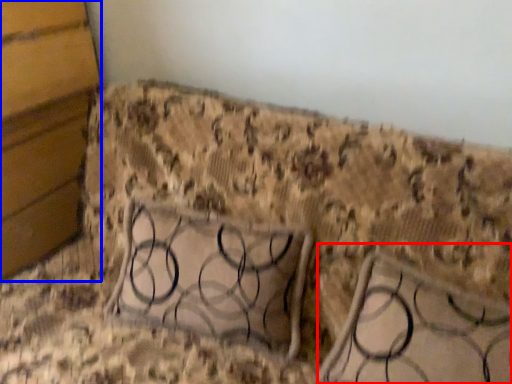
Question: Which object appears farthest to the camera in this image, furniture (highlighted by a red box) or panel (highlighted by a blue box)?

Choices:
 (A) furniture
 (B) panel

Answer: (B)